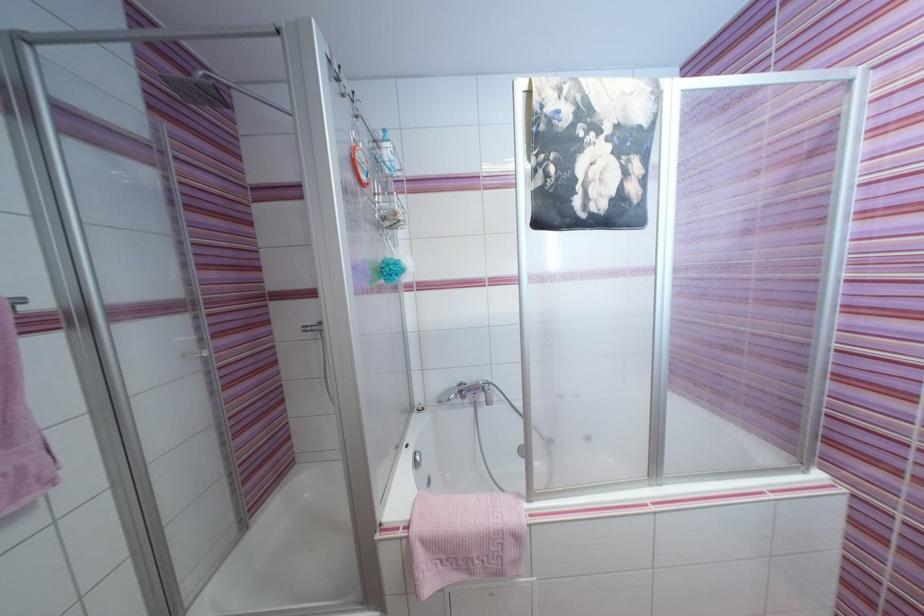
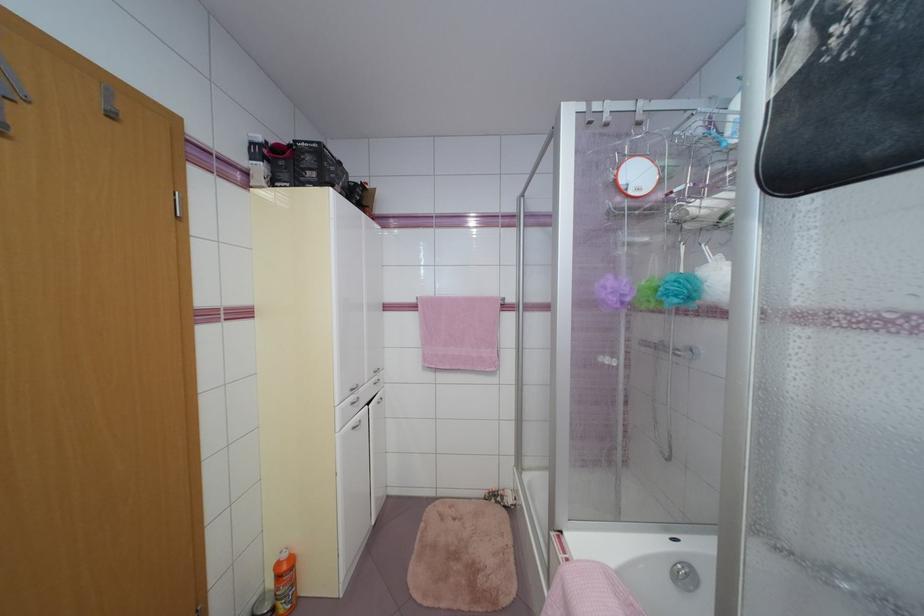
In the second image, find the point that corresponds to (x=395, y=277) in the first image.

(674, 298)